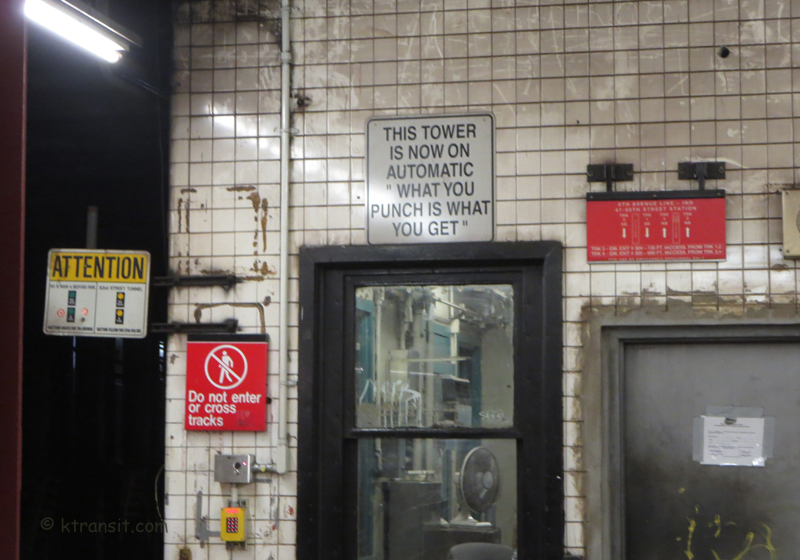
Where is `door`? door is located at coordinates (660, 477).